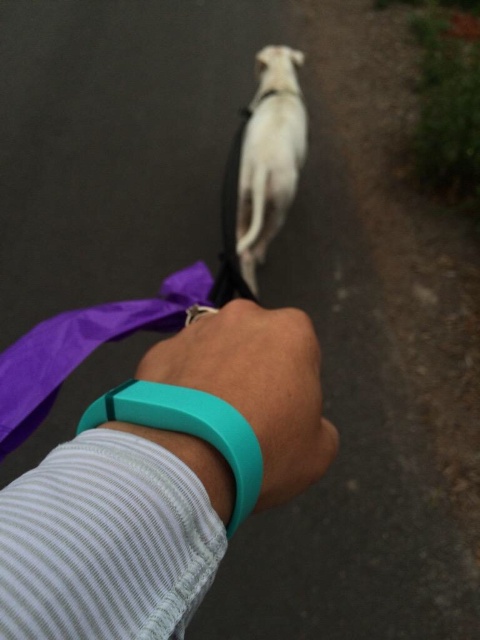
You are a dog walker who needs to measure the distance between the teal rubber wristband at center and the teal rubber band at lower center. Can you confirm if the distance is more than 1.5 inches?

The distance between the teal rubber wristband at center and the teal rubber band at lower center is 1.77 inches, which is more than 1.5 inches.

Based on the photo, you are holding a leash attached to a white dog. There is a point at coordinates point (193, 461). Can you reach this point with your hand while holding the leash?

The point at coordinates point (193, 461) is 13.00 inches away from the viewer, so yes, you can reach it with your hand while holding the leash.